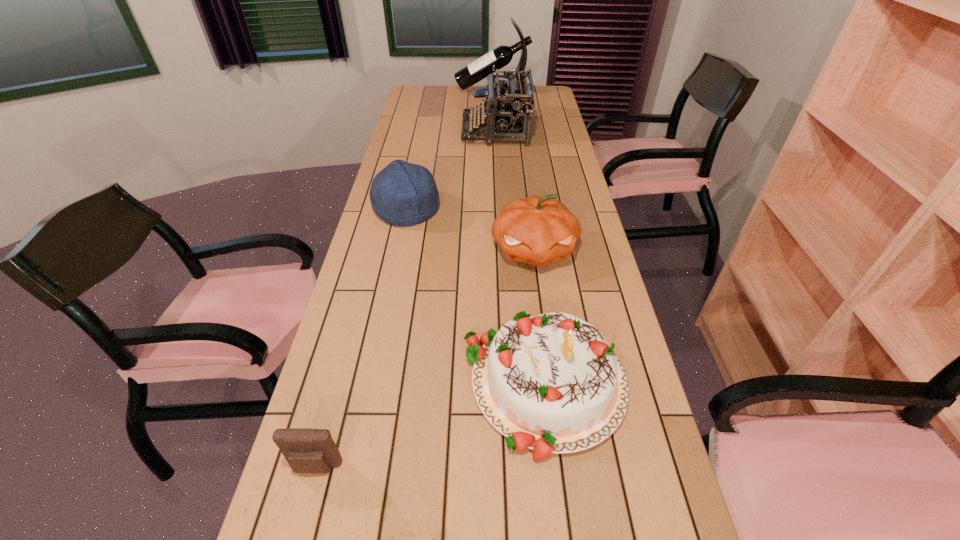
Locate an element on the screen. The height and width of the screenshot is (540, 960). free space located 0.170m on the typing side of the second farthest object is located at coordinates (423, 131).

This screenshot has height=540, width=960. In order to click on free location located on the typing side of the second farthest object in this screenshot , I will do `click(398, 131)`.

Find the location of `vacant region located 0.250m on the typing side of the second farthest object`. vacant region located 0.250m on the typing side of the second farthest object is located at coordinates (405, 131).

This screenshot has width=960, height=540. Find the location of `vacant region located on the front face of the pumpkin`. vacant region located on the front face of the pumpkin is located at coordinates (541, 306).

Locate an element on the screen. The image size is (960, 540). free space located on the back of the cake is located at coordinates (533, 288).

Where is `vacant space located 0.180m on the front of the skullcap`? The width and height of the screenshot is (960, 540). vacant space located 0.180m on the front of the skullcap is located at coordinates (395, 269).

Image resolution: width=960 pixels, height=540 pixels. I want to click on object that is at the far edge, so click(501, 56).

Locate an element on the screen. skullcap that is at the left edge is located at coordinates (403, 194).

At what (x,y) coordinates should I click in order to perform the action: click on pouch at the left edge. Please return your answer as a coordinate pair (x, y). Looking at the image, I should click on (307, 450).

Where is `wine bottle that is positioned at the right edge`? The height and width of the screenshot is (540, 960). wine bottle that is positioned at the right edge is located at coordinates (501, 56).